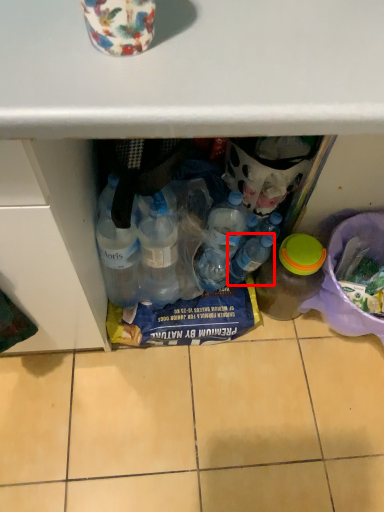
Question: Where is bottle (annotated by the red box) located in relation to bottle in the image?

Choices:
 (A) left
 (B) right

Answer: (A)